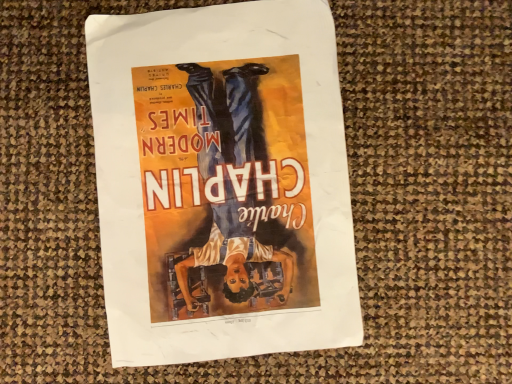
The image size is (512, 384). Describe the element at coordinates (222, 182) in the screenshot. I see `matte paper poster at center` at that location.

This screenshot has height=384, width=512. What are the coordinates of `matte paper poster at center` in the screenshot? It's located at (222, 182).

Where is `matte paper poster at center`? The image size is (512, 384). matte paper poster at center is located at coordinates (222, 182).